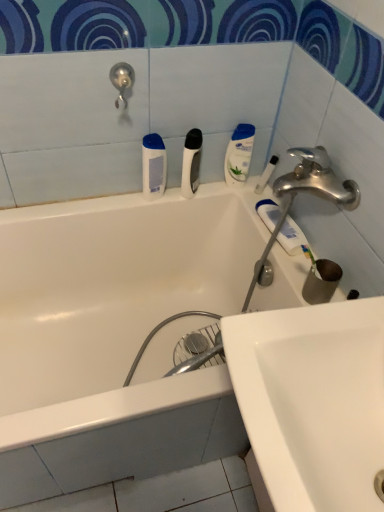
Where is `free area in between white glossy lotion at upper right, the third toiletry from the left, and white matte bottle at upper center, which is the fourth toiletry from right to left`? This screenshot has height=512, width=384. free area in between white glossy lotion at upper right, the third toiletry from the left, and white matte bottle at upper center, which is the fourth toiletry from right to left is located at coordinates pyautogui.click(x=202, y=187).